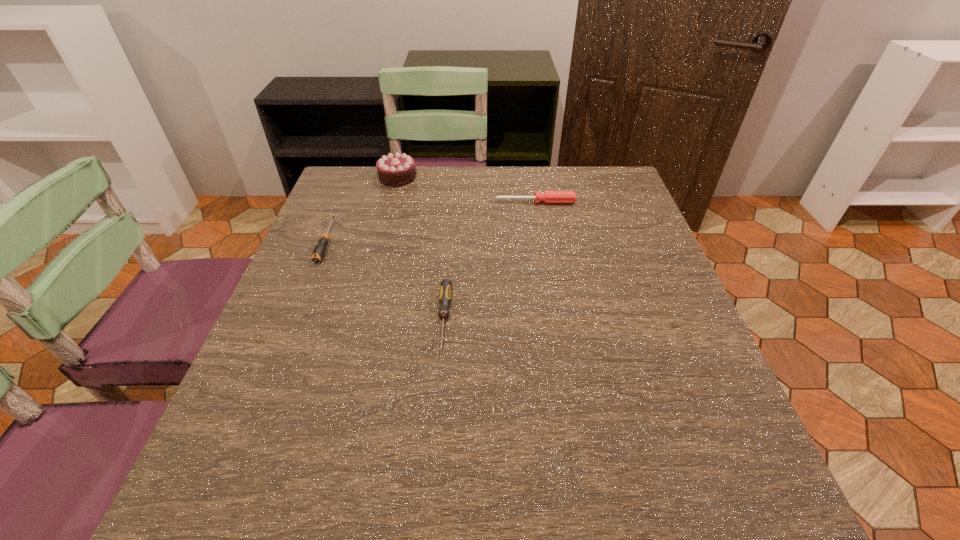
Locate an element on the screen. The height and width of the screenshot is (540, 960). vacant space that is in between the second screwdriver from right to left and the rightmost object is located at coordinates (491, 260).

Find the location of a particular element. unoccupied position between the rightmost screwdriver and the leftmost object is located at coordinates click(431, 222).

Find the location of a particular element. Image resolution: width=960 pixels, height=540 pixels. free space between the leftmost screwdriver and the second object from left to right is located at coordinates (362, 210).

Locate which object ranks second in proximity to the second nearest object. Please provide its 2D coordinates. Your answer should be formatted as a tuple, i.e. [(x, y)], where the tuple contains the x and y coordinates of a point satisfying the conditions above.

[(446, 285)]

Identify which object is located as the nearest to the second screwdriver from left to right. Please provide its 2D coordinates. Your answer should be formatted as a tuple, i.e. [(x, y)], where the tuple contains the x and y coordinates of a point satisfying the conditions above.

[(319, 250)]

Find the location of a particular element. Image resolution: width=960 pixels, height=540 pixels. screwdriver that is the nearest to the second screwdriver from left to right is located at coordinates (319, 250).

Select which screwdriver appears as the closest to the chocolate cake. Please provide its 2D coordinates. Your answer should be formatted as a tuple, i.e. [(x, y)], where the tuple contains the x and y coordinates of a point satisfying the conditions above.

[(319, 250)]